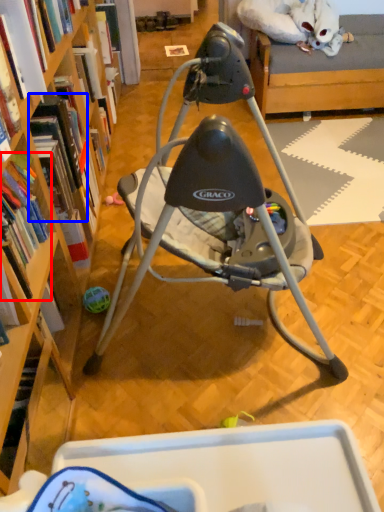
Question: Which of the following is the farthest to the observer, book (highlighted by a red box) or book (highlighted by a blue box)?

Choices:
 (A) book
 (B) book

Answer: (B)